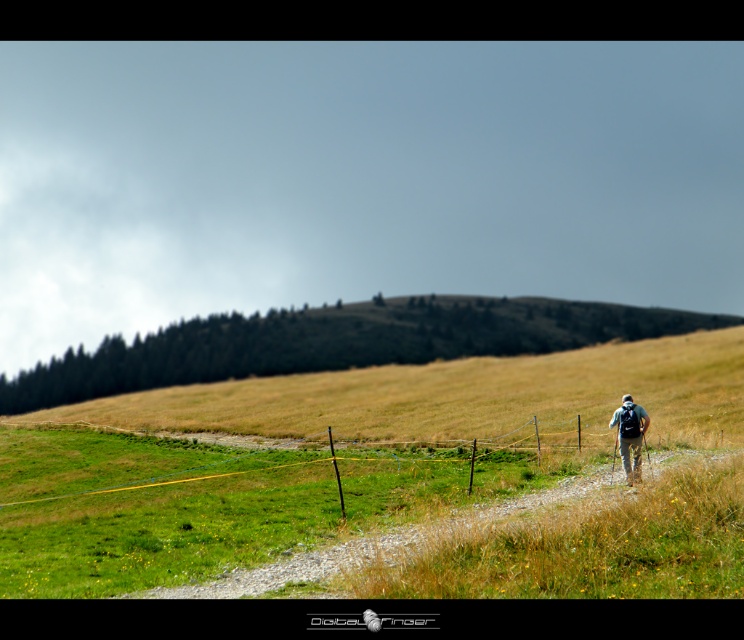
Looking at this image, you are a hiker standing at the point marked by the coordinates point (339, 342). Looking at the scene, which direction should you walk to reach the gravel path that the hiker is on?

The green grassy hillside at center is represented by point (339, 342). Since the gravel path is on the right side of the frame where the hiker is walking, you should walk towards the right to reach the gravel path.

You are a hiker trying to navigate through the path. You see the green grass at center and the green grassy hillside at center. Which one is located to the right side of the other?

The green grass at center is positioned on the right side of green grassy hillside at center.